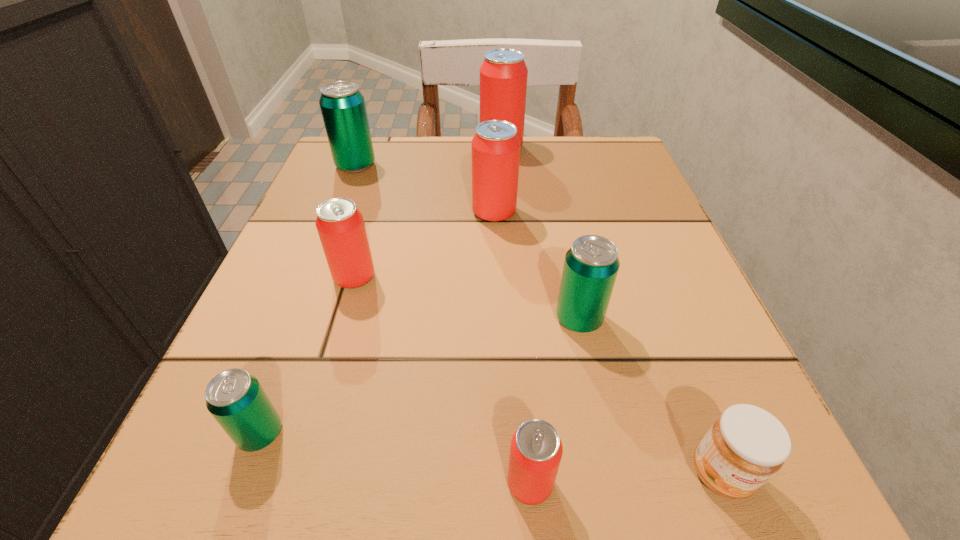
Find the location of `blank space at the right edge`. blank space at the right edge is located at coordinates (663, 292).

This screenshot has height=540, width=960. What are the coordinates of `free space at the far left corner` in the screenshot? It's located at (389, 157).

The width and height of the screenshot is (960, 540). In the image, there is a desktop. What are the coordinates of `vacant space at the near left corner` in the screenshot? It's located at pyautogui.click(x=291, y=488).

At what (x,y) coordinates should I click in order to perform the action: click on vacant point located between the jam and the nearest beer can. Please return your answer as a coordinate pair (x, y). Image resolution: width=960 pixels, height=540 pixels. Looking at the image, I should click on (625, 478).

You are a GUI agent. You are given a task and a screenshot of the screen. Output one action in this format:
    pyautogui.click(x=<x>, y=<y>)
    Task: Click on the empty space that is in between the fifth nearest beer can and the farthest teal beer can
    This screenshot has width=960, height=540.
    Given the screenshot: What is the action you would take?
    click(x=425, y=189)

Where is `free space between the biggest teal beer can and the second nearest teal beer can`? Image resolution: width=960 pixels, height=540 pixels. free space between the biggest teal beer can and the second nearest teal beer can is located at coordinates click(x=468, y=242).

In order to click on free space between the farthest teal beer can and the nearest teal beer can in this screenshot , I will do (x=308, y=300).

You are a GUI agent. You are given a task and a screenshot of the screen. Output one action in this format:
    pyautogui.click(x=<x>, y=<y>)
    Task: Click on the vacant area between the orange jam and the smallest red beer can
    This screenshot has width=960, height=540.
    Given the screenshot: What is the action you would take?
    pyautogui.click(x=625, y=478)

The width and height of the screenshot is (960, 540). What are the coordinates of `vacant space in between the leftmost red beer can and the nearest teal beer can` in the screenshot? It's located at (307, 356).

Find the location of `blank region between the orange jam and the second nearest red beer can`. blank region between the orange jam and the second nearest red beer can is located at coordinates (538, 375).